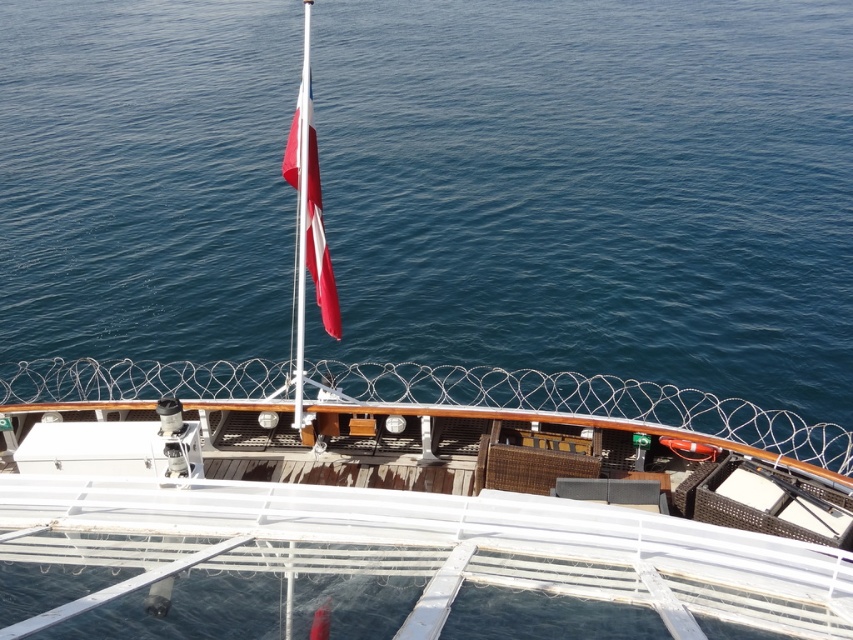
Is point (664, 109) positioned behind point (303, 116)?

Yes, it is behind point (303, 116).

Which is behind, point (103, 355) or point (306, 120)?

The point (103, 355) is behind.

Locate an element on the screen. This screenshot has height=640, width=853. blue water at center is located at coordinates (592, 189).